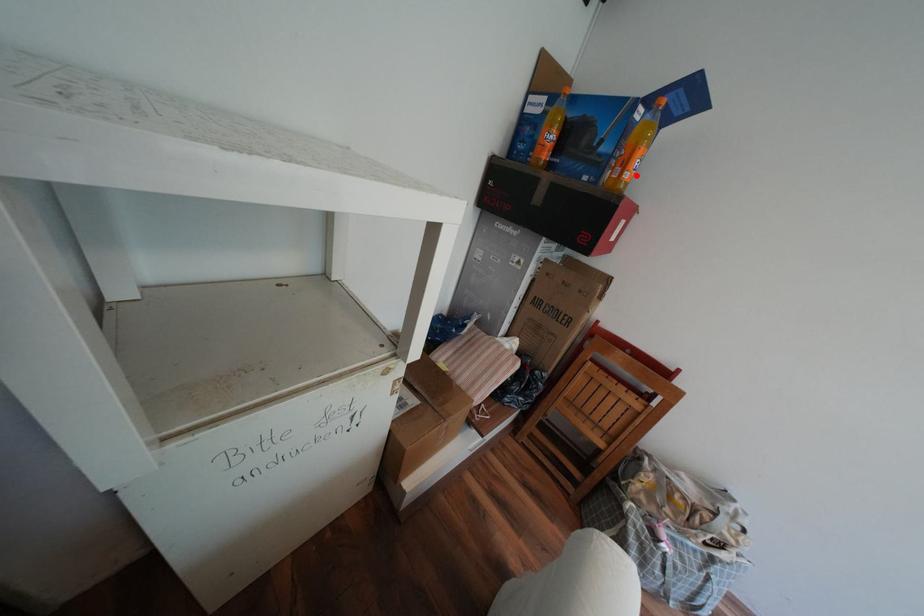
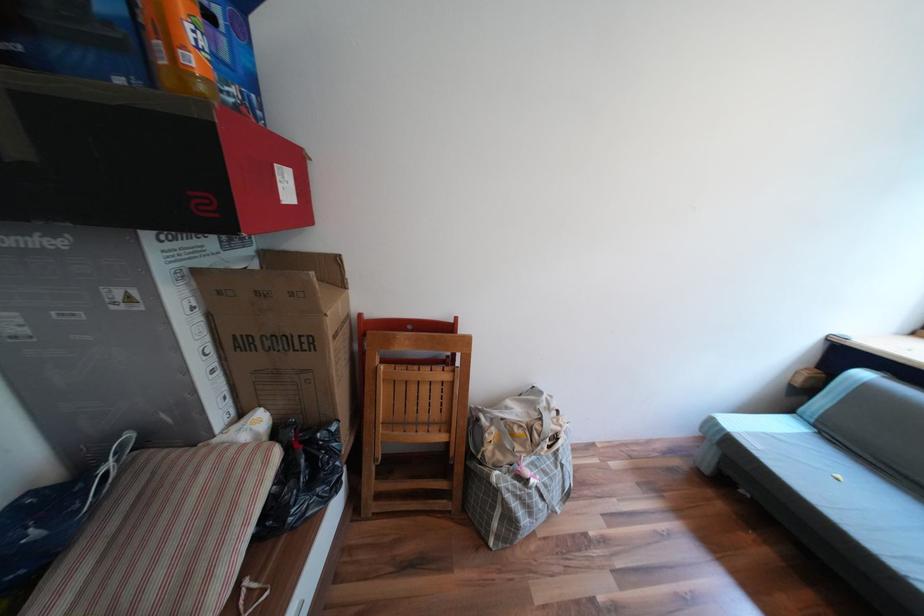
Where in the second image is the point corresponding to the highlighted location from the first image?

(201, 61)